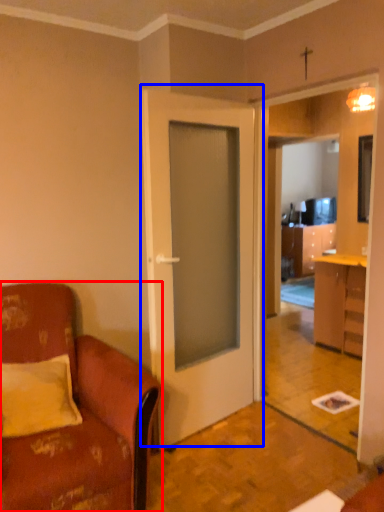
Question: Which point is further to the camera, chair (highlighted by a red box) or door (highlighted by a blue box)?

Choices:
 (A) chair
 (B) door

Answer: (B)